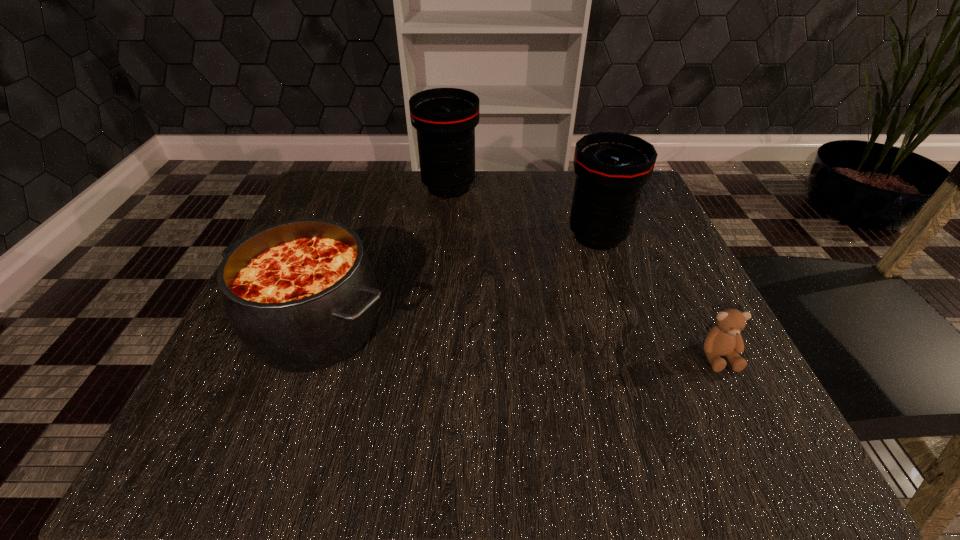
Find the location of a particular element. free space between the left telephoto lens and the teddy bear is located at coordinates (584, 272).

This screenshot has height=540, width=960. I want to click on the closest object to the farther telephoto lens, so click(x=611, y=168).

Locate an element on the screen. the closest object to the second object from right to left is located at coordinates (445, 119).

Identify the location of blank area in the image that satisfies the following two spatial constraints: 1. on the front side of the nearer telephoto lens; 2. on the left side of the left telephoto lens. Image resolution: width=960 pixels, height=540 pixels. (444, 236).